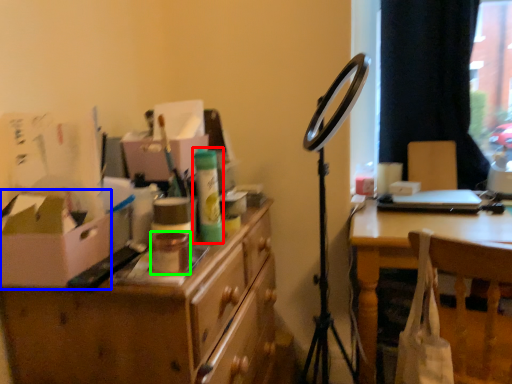
Question: Which is farther away from toiletry (highlighted by a red box)? cardboard box (highlighted by a blue box) or toiletry (highlighted by a green box)?

Choices:
 (A) cardboard box
 (B) toiletry

Answer: (A)